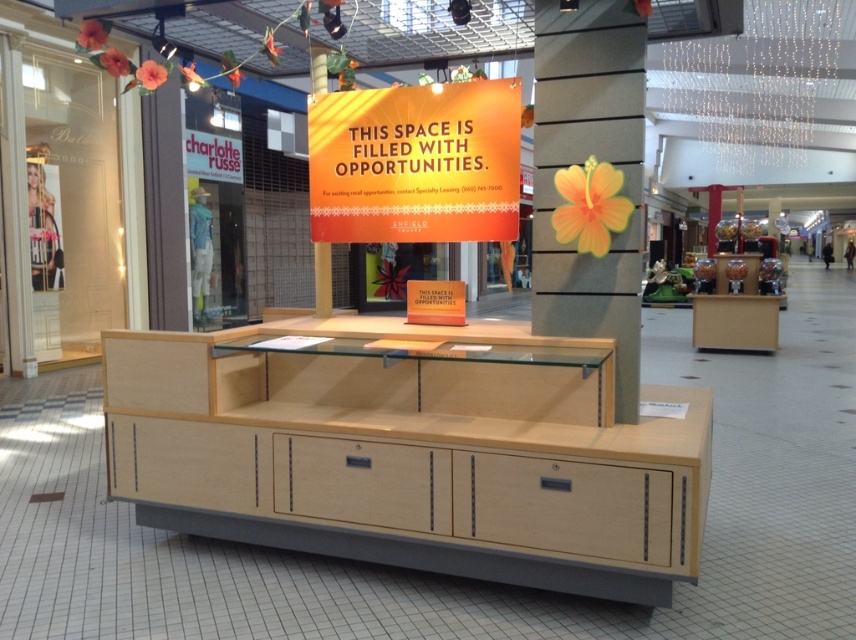
The image size is (856, 640). I want to click on light wood drawer at center, so click(361, 483).

Does matte wood pillar at center have a greater height compared to wooden drawer at lower center?

Yes, matte wood pillar at center is taller than wooden drawer at lower center.

Which of these two, matte wood pillar at center or wooden drawer at lower center, stands shorter?

With less height is wooden drawer at lower center.

Where is `matte wood pillar at center`? This screenshot has width=856, height=640. matte wood pillar at center is located at coordinates (581, 166).

This screenshot has width=856, height=640. What are the coordinates of `matte wood pillar at center` in the screenshot? It's located at (581, 166).

Can you confirm if orange matte sign at center is shorter than light wood drawer at lower left?

No, orange matte sign at center is not shorter than light wood drawer at lower left.

Who is positioned more to the right, orange matte sign at center or light wood drawer at lower left?

Positioned to the right is orange matte sign at center.

Which is behind, point (492, 154) or point (203, 436)?

Positioned behind is point (492, 154).

Where is `orange matte sign at center`? Image resolution: width=856 pixels, height=640 pixels. orange matte sign at center is located at coordinates (415, 163).